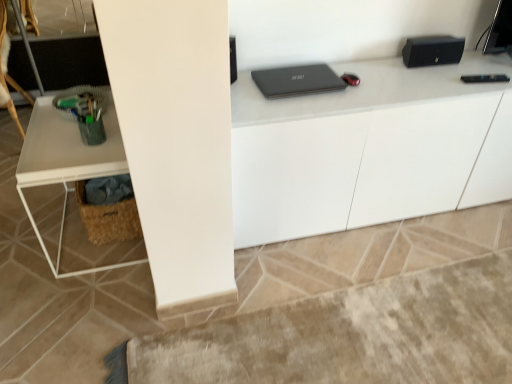
At what (x,y) coordinates should I click in order to perform the action: click on free region on the left part of white matte table at left, which is the 1th computer desk from left to right. Please return your answer as a coordinate pair (x, y). Looking at the image, I should click on pyautogui.click(x=30, y=228).